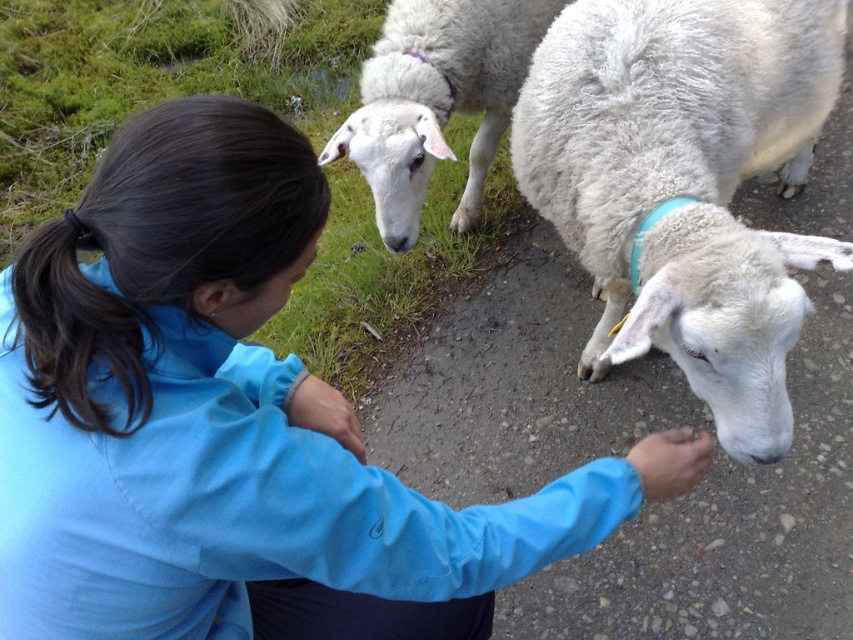
You are a photographer trying to capture a close shot of the blue fabric jacket at center and the white woolen sheep at center. If you want to ensure both subjects are in focus, which one should you adjust your camera focus on first?

The blue fabric jacket at center has a larger width than the white woolen sheep at center, so you should focus on the blue fabric jacket at center first to ensure both are in focus.

You are a photographer trying to capture a photo of the white woolen sheep at center and the dark brown silky hair at upper left. Based on their positions, which one is more to the right?

The white woolen sheep at center is positioned on the right side of dark brown silky hair at upper left, so the white woolen sheep at center is more to the right.